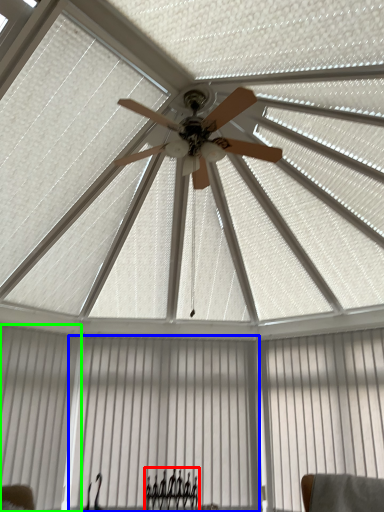
Question: Which is nearer to the furniture (highlighted by a red box)? curtain (highlighted by a blue box) or shutter (highlighted by a green box).

Choices:
 (A) curtain
 (B) shutter

Answer: (A)